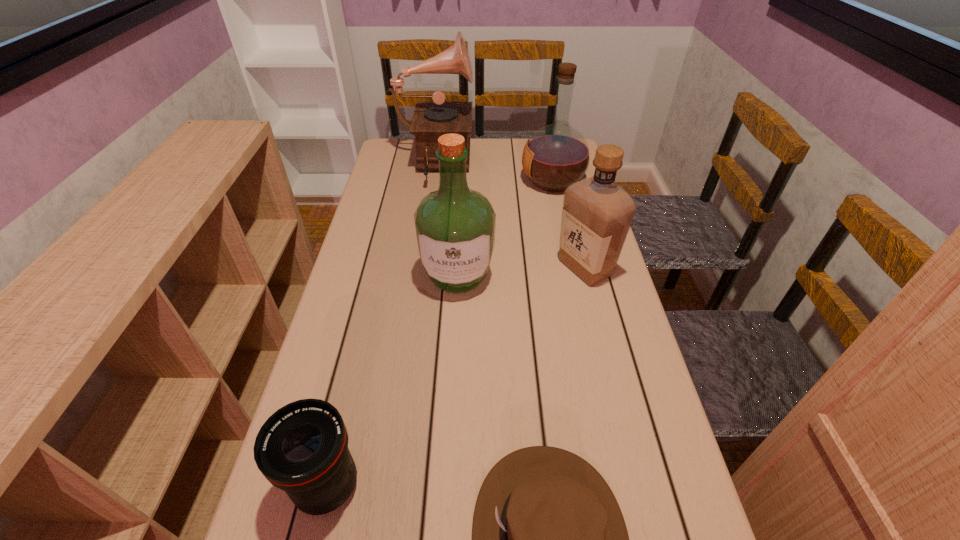
Find the location of a particular element. record player is located at coordinates (431, 120).

Find the location of `the leftmost liquor`. the leftmost liquor is located at coordinates (454, 226).

Locate an element on the screen. the farthest liquor is located at coordinates (557, 155).

Identify the location of telephoto lens. The width and height of the screenshot is (960, 540). (302, 449).

Find the location of a particular element. free region located on the horn of the record player is located at coordinates (517, 165).

Find the location of a particular element. This screenshot has width=960, height=540. vacant space located 0.300m on the front-facing side of the leftmost liquor is located at coordinates (450, 411).

Locate an element on the screen. free space located 0.310m on the front label of the farthest liquor is located at coordinates (432, 181).

What are the coordinates of `free region located on the front label of the farthest liquor` in the screenshot? It's located at (412, 181).

Identify the location of vacant region located 0.050m on the front label of the farthest liquor. The height and width of the screenshot is (540, 960). (506, 181).

I want to click on vacant space positioned 0.350m on the right of the telephoto lens, so click(x=556, y=486).